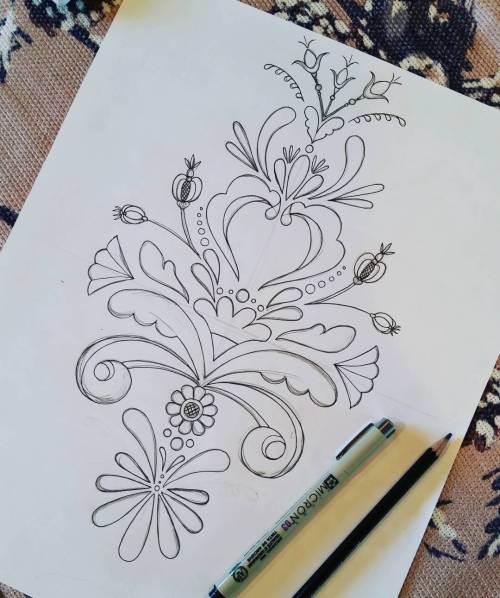
Where is `fan`? fan is located at coordinates (107, 271), (369, 371).